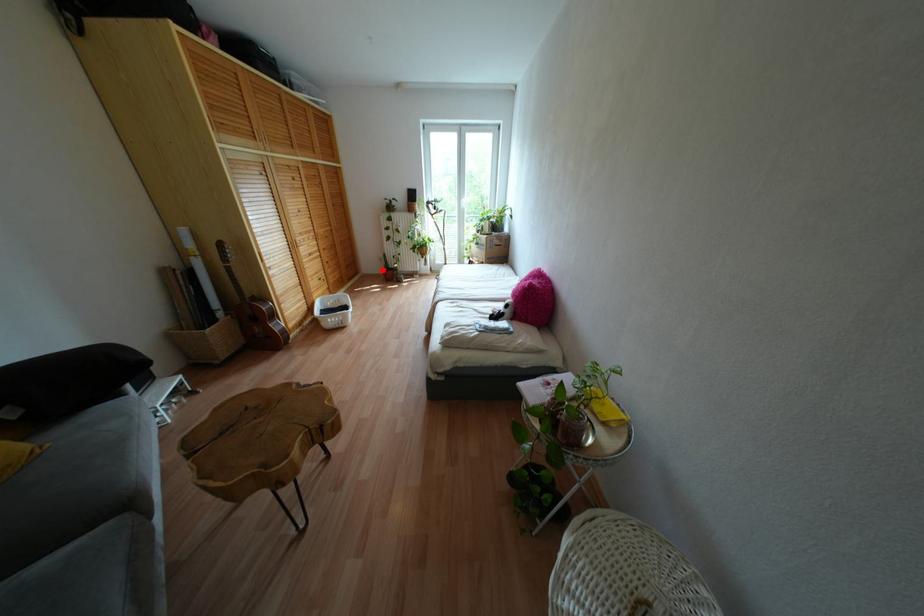
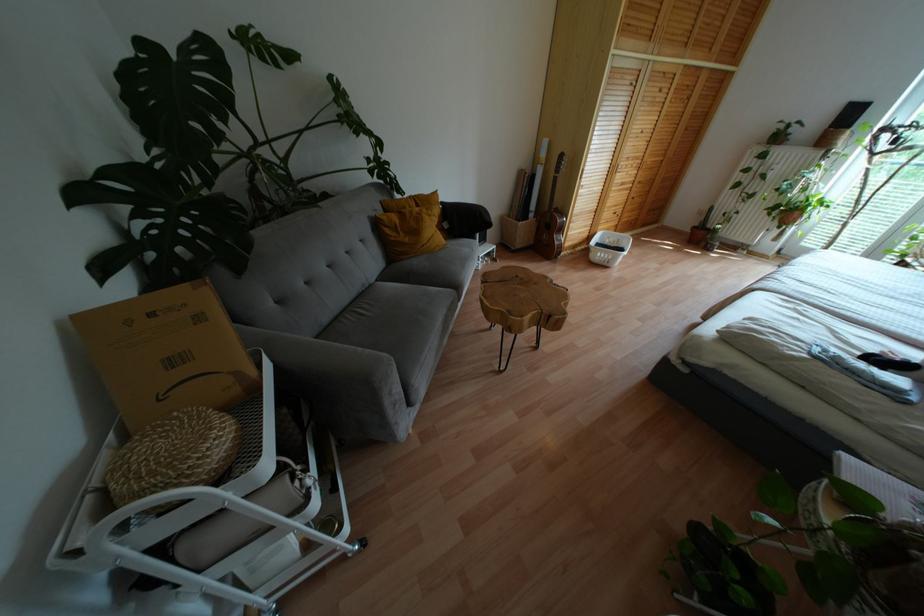
The point at the highlighted location is marked in the first image. Where is the corresponding point in the second image?

(694, 227)